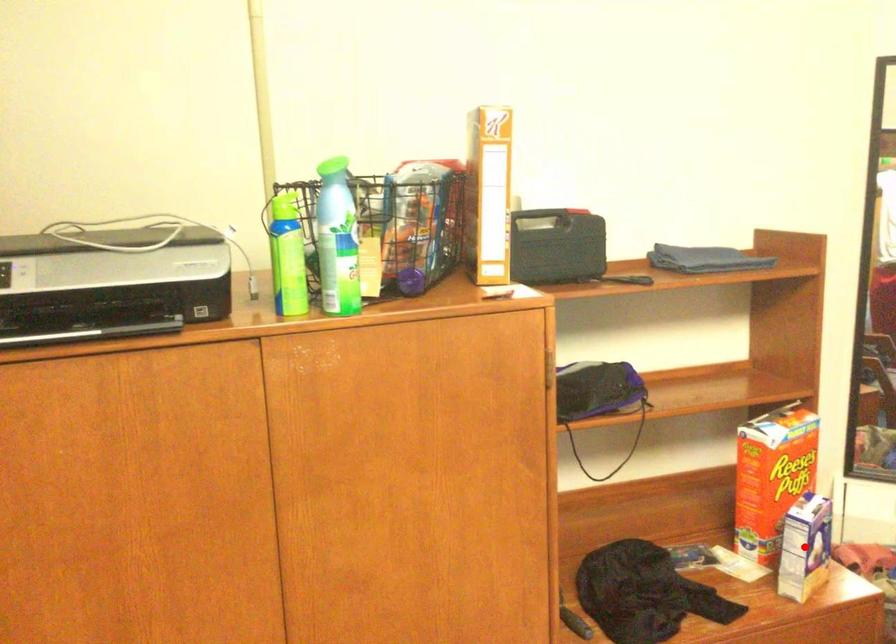
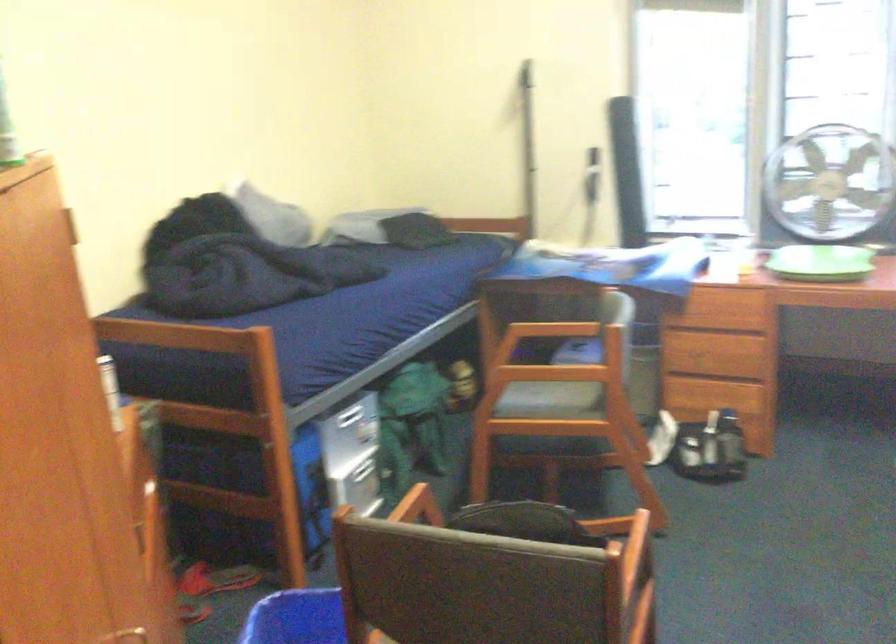
Question: I am providing you with two images of the same scene from different viewpoints. A red point is marked on the first image. At the location where the point appears in image 1, is it still visible in image 2?

Choices:
 (A) Yes
 (B) No

Answer: (B)